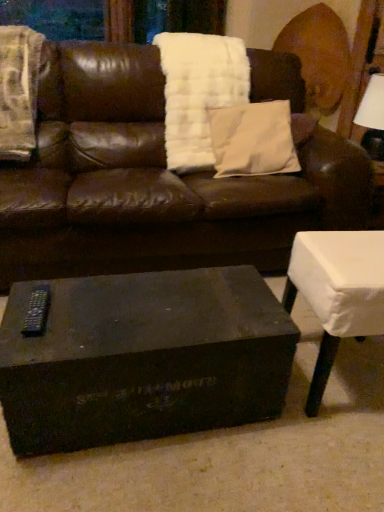
Image resolution: width=384 pixels, height=512 pixels. I want to click on vacant space to the right of black plastic remote at lower left, so click(x=93, y=323).